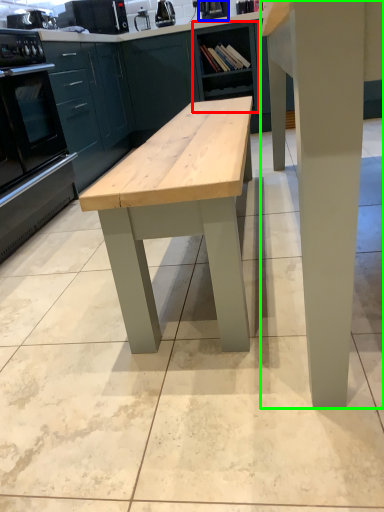
Question: Based on their relative distances, which object is farther from cabinetry (highlighted by a red box)? Choose from appliance (highlighted by a blue box) and table (highlighted by a green box).

Choices:
 (A) appliance
 (B) table

Answer: (B)